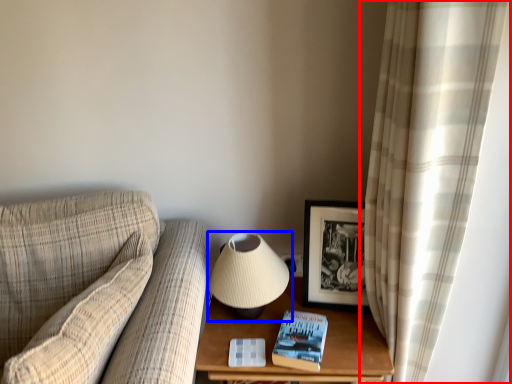
Question: Which point is further to the camera, curtain (highlighted by a red box) or lamp (highlighted by a blue box)?

Choices:
 (A) curtain
 (B) lamp

Answer: (B)